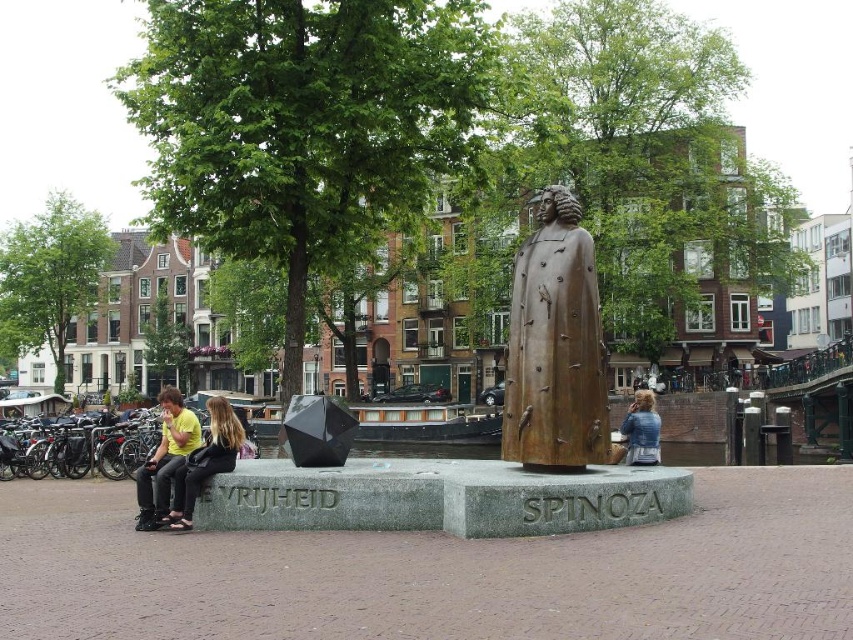
You are standing at the entrance of the plaza and want to find the bronze statue at center. According to the coordinates provided, in which direction should you move relative to your current position?

The bronze statue at center is located at coordinates point [555,348], so you should move towards the center of the plaza to reach it.

You are a tailor who needs to determine which jacket requires more fabric for alterations. Based on the image, which jacket between the matte black jacket at lower left and the blue denim jacket at lower right would need more fabric due to its size?

The blue denim jacket at lower right requires more fabric for alterations because it has a greater width than the matte black jacket at lower left.